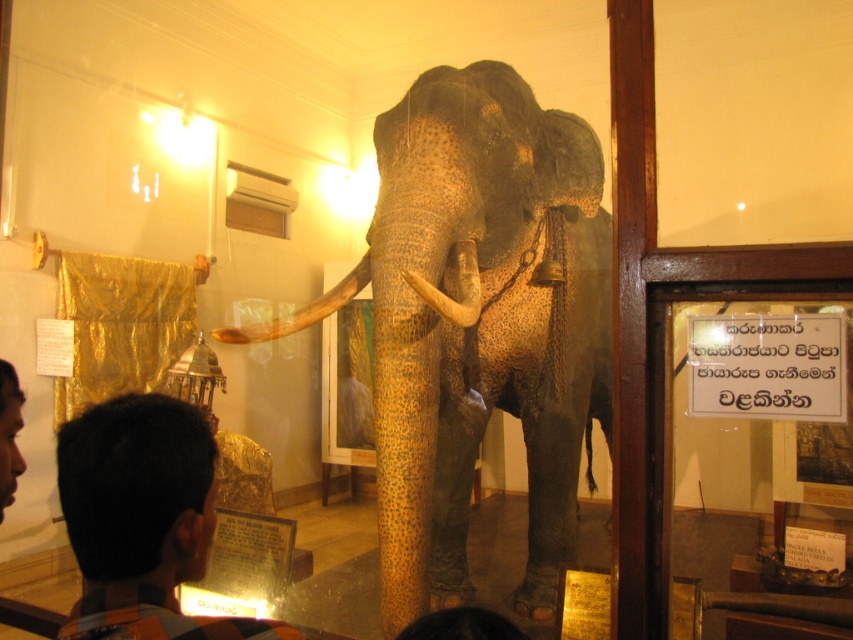
Question: Based on their relative distances, which object is farther from the shiny gold tusk at center?

Choices:
 (A) white ivory tusk at center
 (B) brown hair at lower left

Answer: (B)

Question: Which object appears closest to the camera in this image?

Choices:
 (A) brown hair at lower left
 (B) shiny gold tusk at center

Answer: (A)

Question: Can you confirm if shiny gold tusk at center is positioned to the left of white ivory tusk at center?

Choices:
 (A) yes
 (B) no

Answer: (A)

Question: Is brown hair at lower left positioned behind white ivory tusk at center?

Choices:
 (A) no
 (B) yes

Answer: (A)

Question: Estimate the real-world distances between objects in this image. Which object is closer to the brown hair at lower left?

Choices:
 (A) spotted brown elephant at center
 (B) shiny gold tusk at center
 (C) white ivory tusk at center

Answer: (C)

Question: Observing the image, what is the correct spatial positioning of brown hair at lower left in reference to shiny gold tusk at center?

Choices:
 (A) above
 (B) below

Answer: (B)